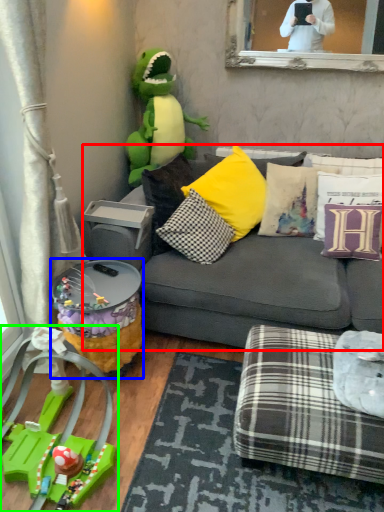
Question: Estimate the real-world distances between objects in this image. Which object is closer to studio couch (highlighted by a red box), side table (highlighted by a blue box) or toy (highlighted by a green box)?

Choices:
 (A) side table
 (B) toy

Answer: (A)